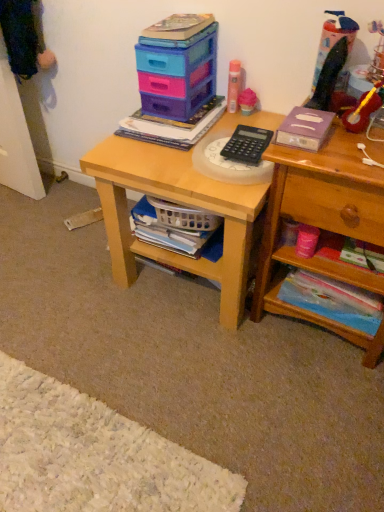
Identify the location of vacant area that is in front of wooden at right. The width and height of the screenshot is (384, 512). (301, 409).